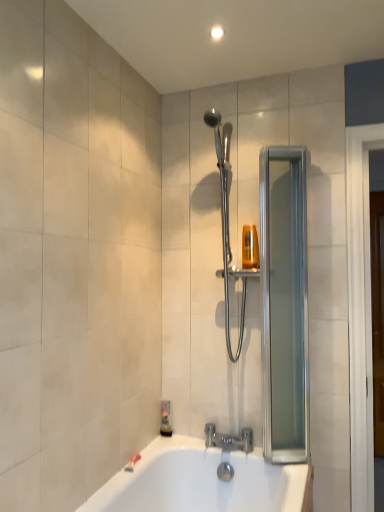
Question: In the image, is translucent plastic soap dispenser at lower left positioned in front of or behind silver metallic faucet at lower center?

Choices:
 (A) front
 (B) behind

Answer: (B)

Question: From the image's perspective, is translucent plastic soap dispenser at lower left positioned above or below silver metallic faucet at lower center?

Choices:
 (A) above
 (B) below

Answer: (A)

Question: Estimate the real-world distances between objects in this image. Which object is farther from the silver metallic faucet at lower center?

Choices:
 (A) polished chrome shower at center
 (B) translucent plastic soap dispenser at lower left
 (C) clear glass screen door at right

Answer: (A)

Question: Which of these objects is positioned farthest from the clear glass screen door at right?

Choices:
 (A) silver metallic faucet at lower center
 (B) polished chrome shower at center
 (C) translucent plastic soap dispenser at lower left

Answer: (C)